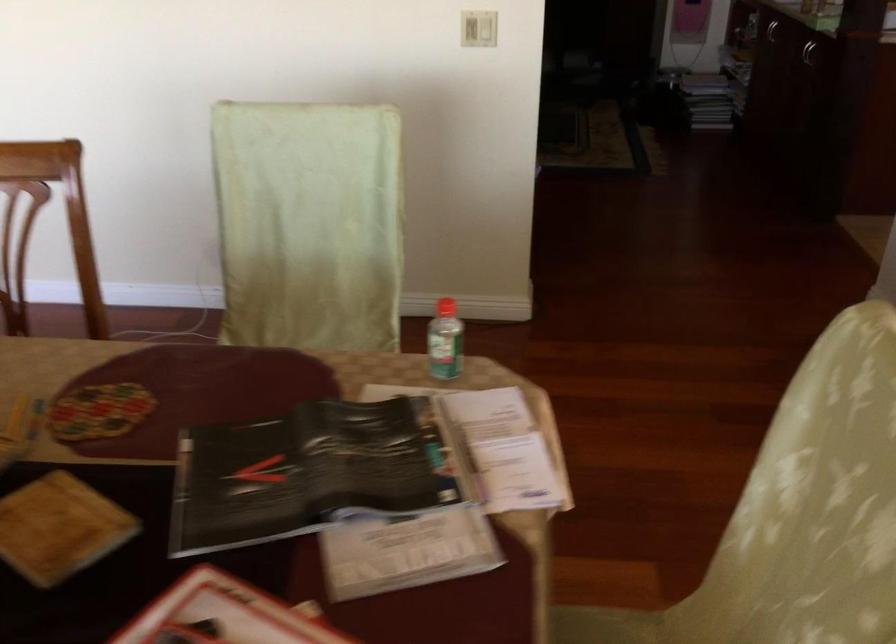
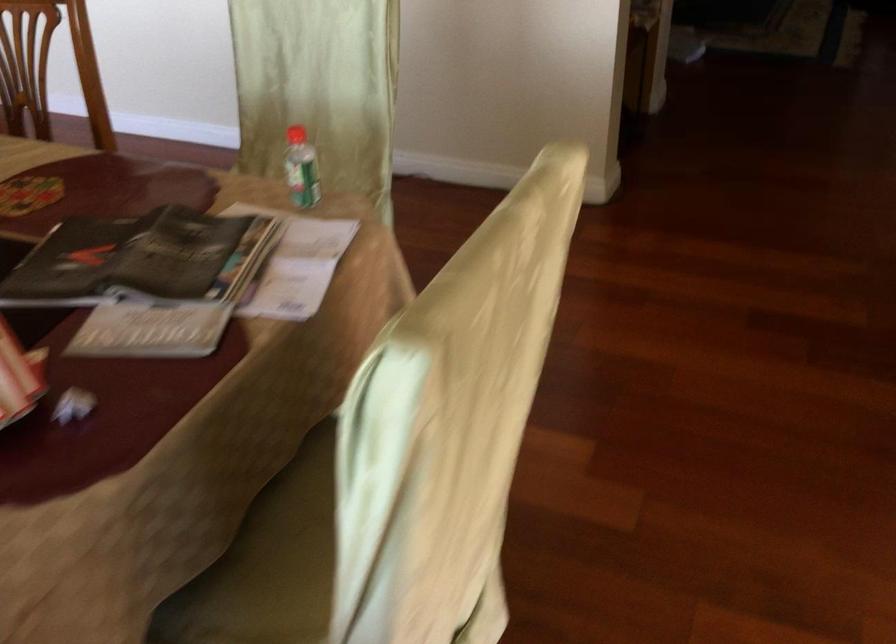
Find the pixel in the second image that matches point 449,308 in the first image.

(296, 135)